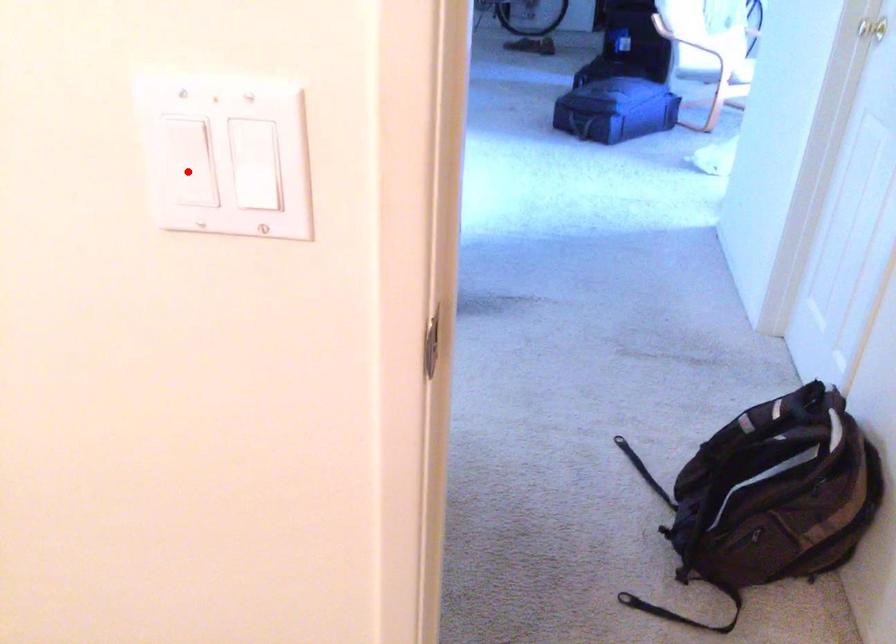
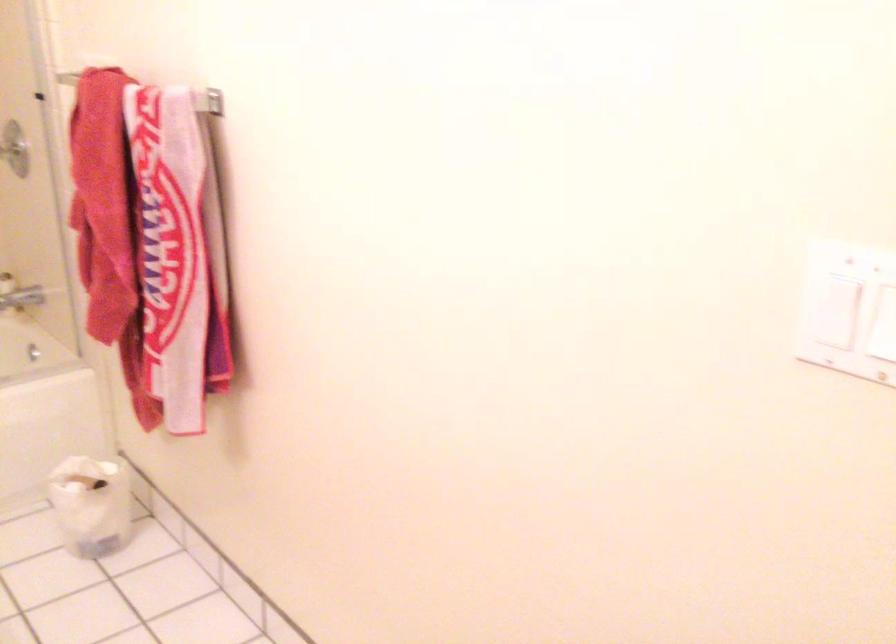
The point at the highlighted location is marked in the first image. Where is the corresponding point in the second image?

(831, 295)